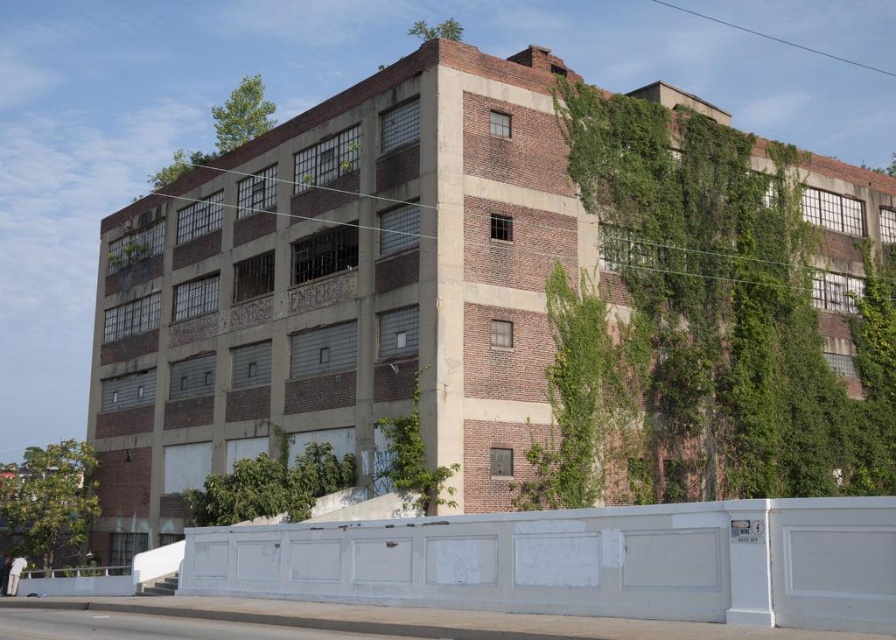
Question: Does green leafy tree at lower left come behind green leafy plant at lower left?

Choices:
 (A) yes
 (B) no

Answer: (A)

Question: Among these points, which one is nearest to the camera?

Choices:
 (A) (263, 488)
 (B) (410, 477)
 (C) (10, 502)

Answer: (B)

Question: In this image, where is green leafy tree at lower left located relative to green leafy plant at lower left?

Choices:
 (A) below
 (B) above

Answer: (A)

Question: Is green leafy tree at lower left smaller than green leafy vines at center?

Choices:
 (A) no
 (B) yes

Answer: (A)

Question: Which point appears closest to the camera in this image?

Choices:
 (A) tap(204, 513)
 (B) tap(412, 470)

Answer: (B)

Question: Which object appears farthest from the camera in this image?

Choices:
 (A) green leafy tree at lower left
 (B) green leafy vines at center

Answer: (A)